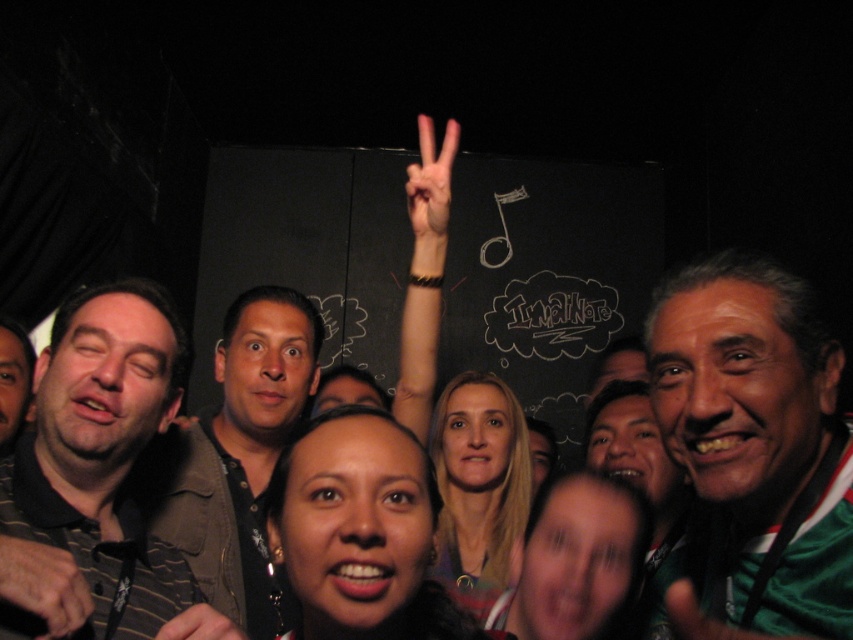
Question: Is green jersey at center to the left of smooth skin hand at center from the viewer's perspective?

Choices:
 (A) no
 (B) yes

Answer: (A)

Question: Is dark brown leather hand at lower left to the right of smooth skin hand at center from the viewer's perspective?

Choices:
 (A) yes
 (B) no

Answer: (B)

Question: Which of the following is the farthest from the observer?

Choices:
 (A) (9, 362)
 (B) (198, 472)
 (C) (94, 544)

Answer: (A)

Question: Which point appears closest to the camera in this image?

Choices:
 (A) (418, 189)
 (B) (56, 426)

Answer: (B)

Question: Which of the following is the closest to the observer?

Choices:
 (A) dark brown leather jacket at left
 (B) green jersey at center
 (C) dark brown leather hand at lower left

Answer: (C)

Question: Is dark brown leather hand at lower left to the left of white matte hand at upper center from the viewer's perspective?

Choices:
 (A) no
 (B) yes

Answer: (B)